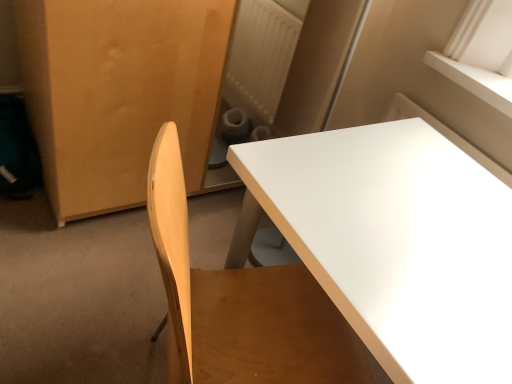
Question: Should I look upward or downward to see white glossy table at center?

Choices:
 (A) down
 (B) up

Answer: (A)

Question: Is matte wood armoire at left further to the viewer compared to white glossy table at center?

Choices:
 (A) yes
 (B) no

Answer: (A)

Question: From the image's perspective, is matte wood armoire at left below white glossy table at center?

Choices:
 (A) yes
 (B) no

Answer: (B)

Question: Is matte wood armoire at left bigger than white glossy table at center?

Choices:
 (A) yes
 (B) no

Answer: (A)

Question: Is matte wood armoire at left to the left of white glossy table at center from the viewer's perspective?

Choices:
 (A) yes
 (B) no

Answer: (A)

Question: Is matte wood armoire at left thinner than white glossy table at center?

Choices:
 (A) no
 (B) yes

Answer: (A)

Question: Can white glossy table at center be found inside matte wood armoire at left?

Choices:
 (A) no
 (B) yes

Answer: (A)

Question: Can you confirm if white glossy table at center is positioned to the left of matte wood armoire at left?

Choices:
 (A) yes
 (B) no

Answer: (B)

Question: Does white glossy table at center touch matte wood armoire at left?

Choices:
 (A) yes
 (B) no

Answer: (B)

Question: Can we say white glossy table at center lies outside matte wood armoire at left?

Choices:
 (A) yes
 (B) no

Answer: (A)

Question: Is the depth of white glossy table at center less than that of matte wood armoire at left?

Choices:
 (A) yes
 (B) no

Answer: (A)

Question: From a real-world perspective, does white glossy table at center sit lower than matte wood armoire at left?

Choices:
 (A) no
 (B) yes

Answer: (B)

Question: Considering the relative positions of white glossy table at center and matte wood armoire at left in the image provided, is white glossy table at center behind matte wood armoire at left?

Choices:
 (A) yes
 (B) no

Answer: (B)

Question: Considering the positions of matte wood armoire at left and white glossy table at center in the image, is matte wood armoire at left wider or thinner than white glossy table at center?

Choices:
 (A) thin
 (B) wide

Answer: (B)